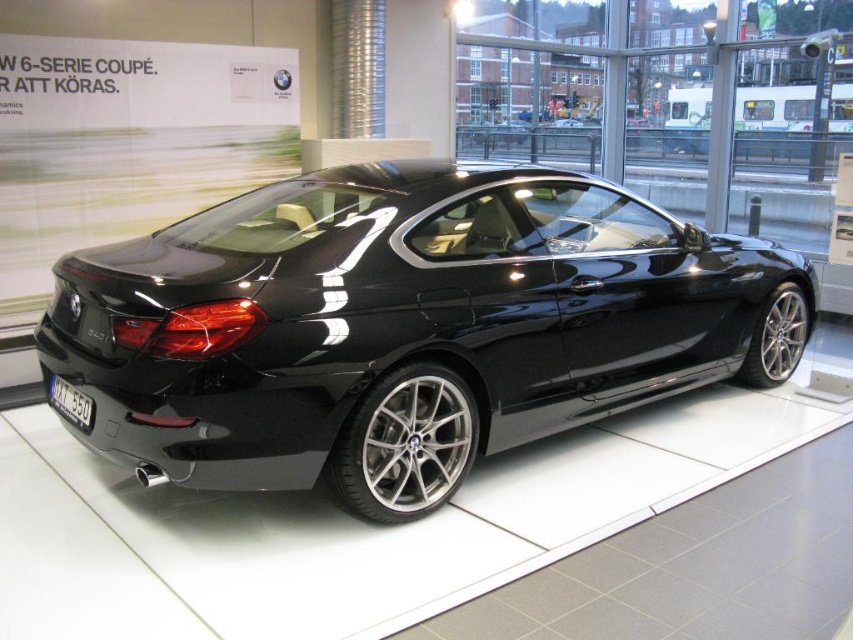
You are a photographer trying to capture the glossy black car at center and the black plastic license plate at rear in a single shot. Considering their heights, which object will appear taller in your photo?

The glossy black car at center appears taller in the photo because it has a greater height compared to the black plastic license plate at rear.

Based on the photo, you are a delivery person who needs to place a small package on the black plastic license plate at rear of the glossy black car at center. The package requires at least 4 feet of space to be placed safely. Can you place the package there?

The distance between the glossy black car at center and the black plastic license plate at rear is 4.48 feet, which is more than the required 4 feet. Therefore, you can safely place the package there.

You are a photographer trying to capture the glossy black car at center and the black plastic license plate at rear in a single shot. Since the car is bigger than the license plate, which object should you focus on first to ensure both are in frame?

The glossy black car at center is bigger than the black plastic license plate at rear, so focus on the car first to ensure it fits, then adjust to include the license plate.